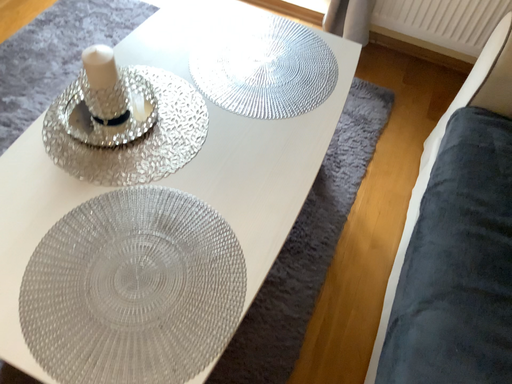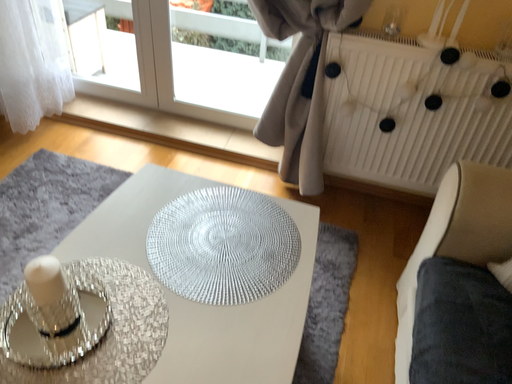
Question: How did the camera likely rotate when shooting the video?

Choices:
 (A) rotated downward
 (B) rotated upward

Answer: (B)